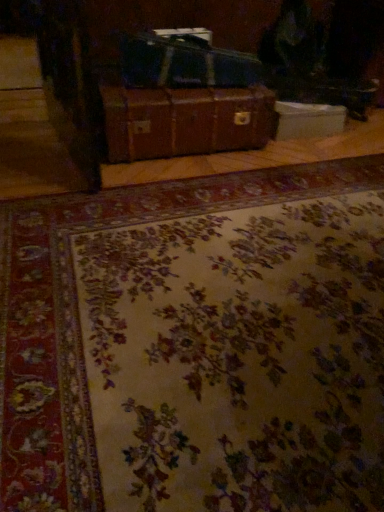
Question: Considering the positions of point (142, 69) and point (276, 320), is point (142, 69) closer or farther from the camera than point (276, 320)?

Choices:
 (A) closer
 (B) farther

Answer: (B)

Question: In terms of size, does shiny black suitcase at center appear bigger or smaller than floral-patterned carpet at center?

Choices:
 (A) small
 (B) big

Answer: (A)

Question: Estimate the real-world distances between objects in this image. Which object is closer to the floral-patterned carpet at center?

Choices:
 (A) brown leather suitcase at center
 (B) white cardboard box at center
 (C) shiny black suitcase at center

Answer: (A)

Question: Which is nearer to the shiny black suitcase at center?

Choices:
 (A) brown leather suitcase at center
 (B) floral-patterned carpet at center
 (C) white cardboard box at center

Answer: (A)